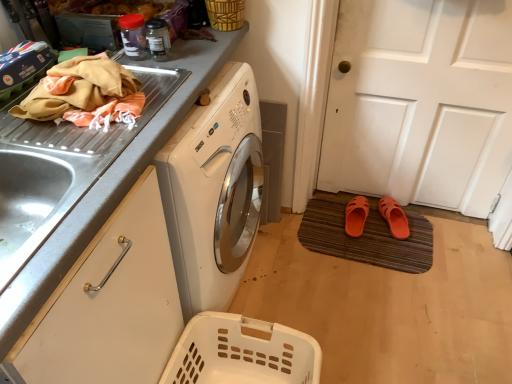
What do you see at coordinates (242, 352) in the screenshot? The image size is (512, 384). I see `white plastic laundry basket at lower center, which is counted as the 1th basket, starting from the bottom` at bounding box center [242, 352].

Find the location of a particular element. This screenshot has width=512, height=384. woven bamboo basket at upper center, the first basket when ordered from top to bottom is located at coordinates (225, 14).

The height and width of the screenshot is (384, 512). What do you see at coordinates (225, 14) in the screenshot? I see `woven bamboo basket at upper center, which ranks as the second basket in bottom-to-top order` at bounding box center [225, 14].

Describe the element at coordinates (366, 238) in the screenshot. The width and height of the screenshot is (512, 384). I see `brown textured doormat at lower right` at that location.

Measure the distance between point (x=360, y=248) and camera.

The distance of point (x=360, y=248) from camera is 1.93 meters.

What is the approximate width of white matte door at lower right?

The width of white matte door at lower right is 4.24 inches.

The width and height of the screenshot is (512, 384). I want to click on orange rubber sandals at lower right, positioned as the 1th footwear in right-to-left order, so click(394, 217).

At what (x,y) coordinates should I click in order to perform the action: click on the 2nd footwear directly beneath the orange fabric at upper left (from a real-world perspective). Please return your answer as a coordinate pair (x, y). This screenshot has width=512, height=384. Looking at the image, I should click on (394, 217).

In the scene shown: Is orange rubber sandals at lower right, which appears as the 2th footwear when viewed from the left, next to orange fabric at upper left and touching it?

orange rubber sandals at lower right, which appears as the 2th footwear when viewed from the left, and orange fabric at upper left are not in contact.

Considering the relative positions of orange rubber sandals at lower right, positioned as the 1th footwear in right-to-left order, and orange fabric at upper left in the image provided, is orange rubber sandals at lower right, positioned as the 1th footwear in right-to-left order, to the right of orange fabric at upper left from the viewer's perspective?

Correct, you'll find orange rubber sandals at lower right, positioned as the 1th footwear in right-to-left order, to the right of orange fabric at upper left.

From a real-world perspective, does orange rubber sandals at lower right, which appears as the 2th footwear when viewed from the left, stand above orange fabric at upper left?

Actually, orange rubber sandals at lower right, which appears as the 2th footwear when viewed from the left, is physically below orange fabric at upper left in the real world.

Who is shorter, metallic gray countertop at upper left or white matte door at lower right?

metallic gray countertop at upper left is shorter.

From a real-world perspective, is metallic gray countertop at upper left located higher than white matte door at lower right?

No.

What's the angular difference between metallic gray countertop at upper left and white matte door at lower right's facing directions?

The angular difference between metallic gray countertop at upper left and white matte door at lower right is 92.2 degrees.

Considering the positions of objects metallic gray countertop at upper left and white matte door at lower right in the image provided, who is more to the right, metallic gray countertop at upper left or white matte door at lower right?

white matte door at lower right is more to the right.

Is orange fabric at upper left outside of white matte door at lower right?

Yes.

From a real-world perspective, is orange fabric at upper left under white matte door at lower right?

Actually, orange fabric at upper left is physically above white matte door at lower right in the real world.

Between orange fabric at upper left and white matte door at lower right, which one appears on the left side from the viewer's perspective?

Positioned to the left is orange fabric at upper left.

How distant is orange fabric at upper left from white matte door at lower right?

orange fabric at upper left is 3.81 feet away from white matte door at lower right.

From a real-world perspective, who is located higher, orange rubber sandals at lower right, positioned as the 1th footwear in right-to-left order, or woven bamboo basket at upper center, which ranks as the second basket in bottom-to-top order?

woven bamboo basket at upper center, which ranks as the second basket in bottom-to-top order, is physically above.

Which is in front, point (379, 208) or point (217, 18)?

Point (217, 18)

From the picture: Visually, is orange rubber sandals at lower right, which appears as the 2th footwear when viewed from the left, positioned to the left or to the right of woven bamboo basket at upper center, which ranks as the second basket in bottom-to-top order?

Based on their positions, orange rubber sandals at lower right, which appears as the 2th footwear when viewed from the left, is located to the right of woven bamboo basket at upper center, which ranks as the second basket in bottom-to-top order.

From the picture: Is orange rubber sandals at lower right, positioned as the 1th footwear in right-to-left order, oriented away from woven bamboo basket at upper center, the first basket when ordered from top to bottom?

No, orange rubber sandals at lower right, positioned as the 1th footwear in right-to-left order,'s orientation is not away from woven bamboo basket at upper center, the first basket when ordered from top to bottom.

In the image, there is a white plastic laundry basket at lower center, which is counted as the 1th basket, starting from the bottom. In order to click on door above it (from the image's perspective) in this screenshot , I will do `click(421, 102)`.

Which of these two, white matte door at lower right or white plastic laundry basket at lower center, the 2th basket when ordered from top to bottom, stands shorter?

With less height is white plastic laundry basket at lower center, the 2th basket when ordered from top to bottom.

Does white matte door at lower right have a smaller size compared to white plastic laundry basket at lower center, which is counted as the 1th basket, starting from the bottom?

Incorrect, white matte door at lower right is not smaller in size than white plastic laundry basket at lower center, which is counted as the 1th basket, starting from the bottom.

From the image's perspective, is white matte door at lower right located above or below white plastic laundry basket at lower center, which is counted as the 1th basket, starting from the bottom?

Based on their image positions, white matte door at lower right is located above white plastic laundry basket at lower center, which is counted as the 1th basket, starting from the bottom.

Is the position of orange rubber sandals at lower right, which appears as the 2th footwear when viewed from the left, less distant than that of white plastic laundry basket at lower center, which is counted as the 1th basket, starting from the bottom?

No, it is not.

Can you confirm if orange rubber sandals at lower right, positioned as the 1th footwear in right-to-left order, is thinner than white plastic laundry basket at lower center, the 2th basket when ordered from top to bottom?

Yes.

How different are the orientations of orange rubber sandals at lower right, which appears as the 2th footwear when viewed from the left, and white plastic laundry basket at lower center, which is counted as the 1th basket, starting from the bottom, in degrees?

The facing directions of orange rubber sandals at lower right, which appears as the 2th footwear when viewed from the left, and white plastic laundry basket at lower center, which is counted as the 1th basket, starting from the bottom, are 78.9 degrees apart.

From the image's perspective, who appears lower, orange rubber sandals at lower right, positioned as the 1th footwear in right-to-left order, or white plastic laundry basket at lower center, which is counted as the 1th basket, starting from the bottom?

white plastic laundry basket at lower center, which is counted as the 1th basket, starting from the bottom, appears lower in the image.

Is metallic gray countertop at upper left further to the viewer compared to orange fabric at upper left?

No, metallic gray countertop at upper left is in front of orange fabric at upper left.

Is metallic gray countertop at upper left to the right of orange fabric at upper left from the viewer's perspective?

Incorrect, metallic gray countertop at upper left is not on the right side of orange fabric at upper left.

Is orange fabric at upper left surrounded by metallic gray countertop at upper left?

No, metallic gray countertop at upper left does not contain orange fabric at upper left.

At what (x,y) coordinates should I click in order to perform the action: click on the 2nd footwear below the orange fabric at upper left (from the image's perspective). Please return your answer as a coordinate pair (x, y). This screenshot has height=384, width=512. Looking at the image, I should click on (394, 217).

The height and width of the screenshot is (384, 512). In order to click on countertop lying on the left of white matte door at lower right in this screenshot , I will do `click(110, 186)`.

Based on the photo, when comparing their distances from white matte door at lower right, does orange rubber slipper at lower center, acting as the 2th footwear starting from the right, or orange rubber sandals at lower right, positioned as the 1th footwear in right-to-left order, seem further?

orange rubber slipper at lower center, acting as the 2th footwear starting from the right, lies further to white matte door at lower right than the other object.

Based on their spatial positions, is brown textured doormat at lower right or orange fabric at upper left further from orange rubber sandals at lower right, which appears as the 2th footwear when viewed from the left?

The object further to orange rubber sandals at lower right, which appears as the 2th footwear when viewed from the left, is orange fabric at upper left.

Which object lies nearer to the anchor point orange rubber sandals at lower right, which appears as the 2th footwear when viewed from the left, white plastic laundry basket at lower center, which is counted as the 1th basket, starting from the bottom, or orange rubber slipper at lower center, acting as the 2th footwear starting from the right?

orange rubber slipper at lower center, acting as the 2th footwear starting from the right, is closer to orange rubber sandals at lower right, which appears as the 2th footwear when viewed from the left.

Which object lies further to the anchor point metallic gray countertop at upper left, white matte door at lower right or orange rubber slipper at lower center, arranged as the first footwear when viewed from the left?

orange rubber slipper at lower center, arranged as the first footwear when viewed from the left, is further to metallic gray countertop at upper left.

Based on their spatial positions, is metallic gray countertop at upper left or woven bamboo basket at upper center, which ranks as the second basket in bottom-to-top order, closer to white matte door at lower right?

Among the two, woven bamboo basket at upper center, which ranks as the second basket in bottom-to-top order, is located nearer to white matte door at lower right.

Estimate the real-world distances between objects in this image. Which object is closer to woven bamboo basket at upper center, the first basket when ordered from top to bottom, metallic gray countertop at upper left or brown textured doormat at lower right?

metallic gray countertop at upper left lies closer to woven bamboo basket at upper center, the first basket when ordered from top to bottom, than the other object.

From the image, which object appears to be farther from orange rubber slipper at lower center, acting as the 2th footwear starting from the right, orange fabric at upper left or metallic gray countertop at upper left?

orange fabric at upper left.

Which object lies nearer to the anchor point orange rubber sandals at lower right, which appears as the 2th footwear when viewed from the left, woven bamboo basket at upper center, which ranks as the second basket in bottom-to-top order, or white plastic laundry basket at lower center, which is counted as the 1th basket, starting from the bottom?

The object closer to orange rubber sandals at lower right, which appears as the 2th footwear when viewed from the left, is white plastic laundry basket at lower center, which is counted as the 1th basket, starting from the bottom.

Find the location of a particular element. The image size is (512, 384). door located between metallic gray countertop at upper left and brown textured doormat at lower right in the depth direction is located at coordinates [x=421, y=102].

Where is `doormat between orange fabric at upper left and orange rubber slipper at lower center, acting as the 2th footwear starting from the right, along the z-axis`? doormat between orange fabric at upper left and orange rubber slipper at lower center, acting as the 2th footwear starting from the right, along the z-axis is located at coordinates (366, 238).

At what (x,y) coordinates should I click in order to perform the action: click on footwear between white matte door at lower right and orange rubber sandals at lower right, positioned as the 1th footwear in right-to-left order, along the z-axis. Please return your answer as a coordinate pair (x, y). The image size is (512, 384). Looking at the image, I should click on (356, 216).

Find the location of a particular element. Image resolution: width=512 pixels, height=384 pixels. door positioned between metallic gray countertop at upper left and orange rubber sandals at lower right, which appears as the 2th footwear when viewed from the left, from near to far is located at coordinates (421, 102).